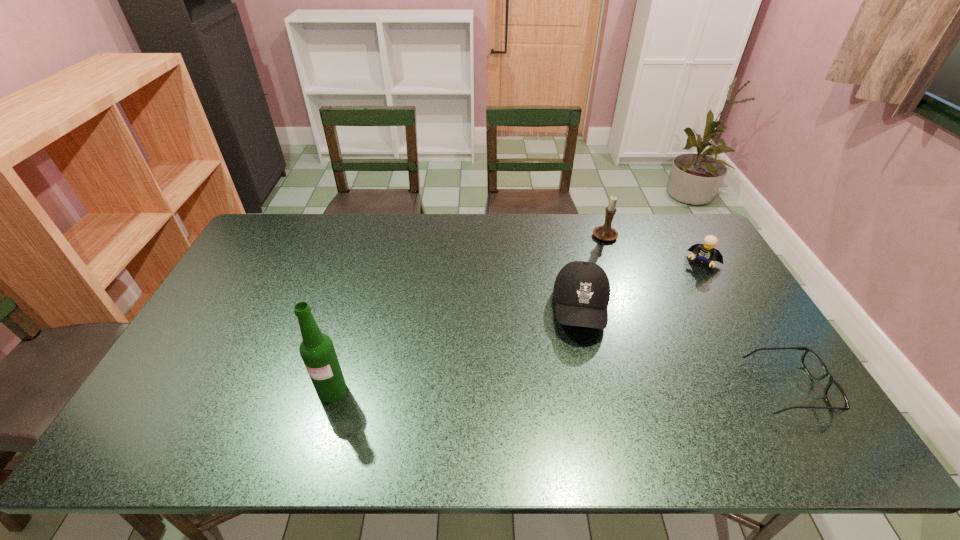
The image size is (960, 540). I want to click on vacant space on the desktop that is between the leftmost object and the shortest object and is positioned on the front-facing side of the third nearest object, so click(x=583, y=389).

Find the location of a particular element. vacant spot on the desktop that is between the leftmost object and the spectacles and is positioned on the front-facing side of the Lego is located at coordinates (627, 389).

Identify the location of vacant spot on the desktop that is between the beer bottle and the spectacles and is positioned on the side of the fourth shortest object with the handle. The height and width of the screenshot is (540, 960). (494, 390).